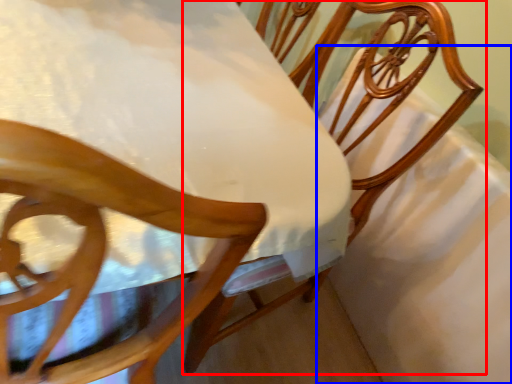
Question: Which object appears farthest to the camera in this image, chair (highlighted by a red box) or sheet (highlighted by a blue box)?

Choices:
 (A) chair
 (B) sheet

Answer: (B)